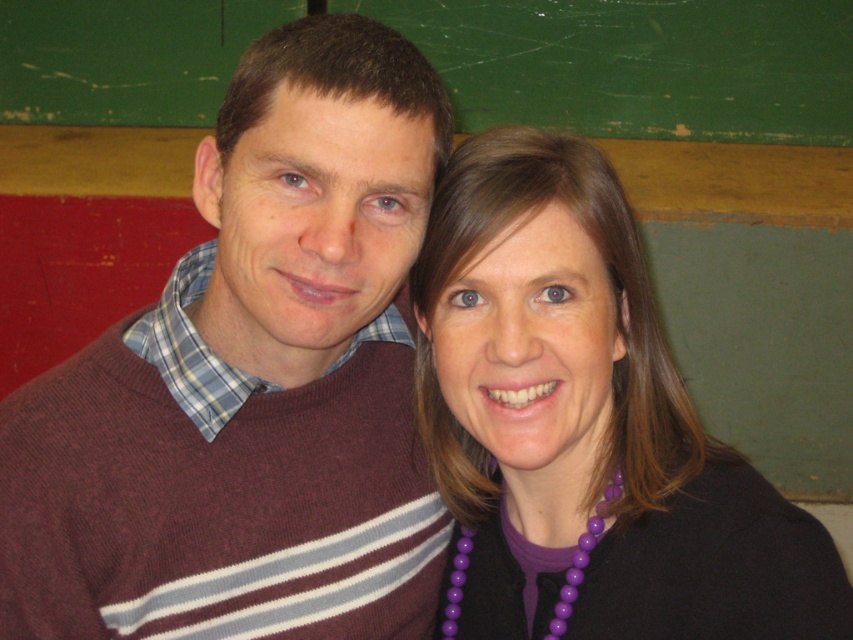
Is maroon sweater at center below purple beaded necklace at lower center?

No, maroon sweater at center is not below purple beaded necklace at lower center.

Between maroon sweater at center and purple beaded necklace at lower center, which one is positioned higher?

maroon sweater at center

Which is in front, point (22, 566) or point (462, 538)?

Point (22, 566) is more forward.

In order to click on maroon sweater at center in this screenshot , I will do `click(251, 381)`.

Which of these two, maroon sweater at center or purple beaded necklace at upper right, stands taller?

With more height is maroon sweater at center.

Is maroon sweater at center positioned behind purple beaded necklace at upper right?

No, maroon sweater at center is in front of purple beaded necklace at upper right.

Measure the distance between maroon sweater at center and camera.

The distance of maroon sweater at center from camera is 31.80 inches.

The height and width of the screenshot is (640, 853). Identify the location of maroon sweater at center. (251, 381).

Does purple beaded necklace at upper right have a larger size compared to purple beaded necklace at lower center?

Yes.

Image resolution: width=853 pixels, height=640 pixels. Identify the location of purple beaded necklace at upper right. (587, 420).